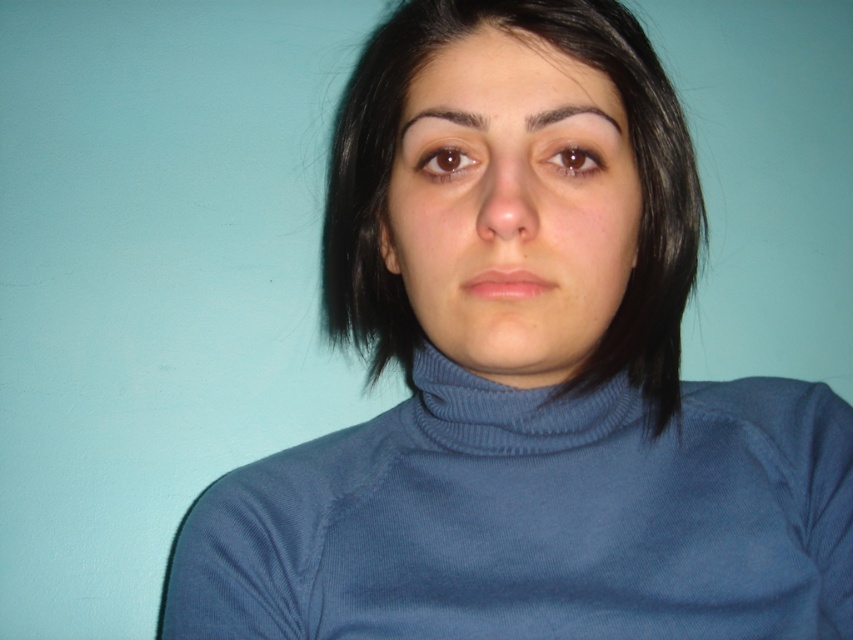
Does matte blue turtleneck at center appear over dark brown hair at upper center?

Actually, matte blue turtleneck at center is below dark brown hair at upper center.

Is matte blue turtleneck at center taller than dark brown hair at upper center?

Yes, matte blue turtleneck at center is taller than dark brown hair at upper center.

What are the coordinates of `matte blue turtleneck at center` in the screenshot? It's located at point(512,209).

Where is `matte blue turtleneck at center`? Image resolution: width=853 pixels, height=640 pixels. matte blue turtleneck at center is located at coordinates (512, 209).

Which is below, brownhaireyebrow at upper center or dark brown hair at upper center?

dark brown hair at upper center is below.

Between brownhaireyebrow at upper center and dark brown hair at upper center, which one appears on the right side from the viewer's perspective?

dark brown hair at upper center

Does point (407, 116) come closer to viewer compared to point (614, 120)?

No, it is behind (614, 120).

Where is `brownhaireyebrow at upper center`? brownhaireyebrow at upper center is located at coordinates (439, 118).

Is blue ribbed polo neck at center further to the viewer compared to brownhaireyebrow at upper center?

Yes, it is.

Is point (474, 419) closer to viewer compared to point (402, 118)?

No, it is not.

Locate an element on the screen. The width and height of the screenshot is (853, 640). blue ribbed polo neck at center is located at coordinates (519, 413).